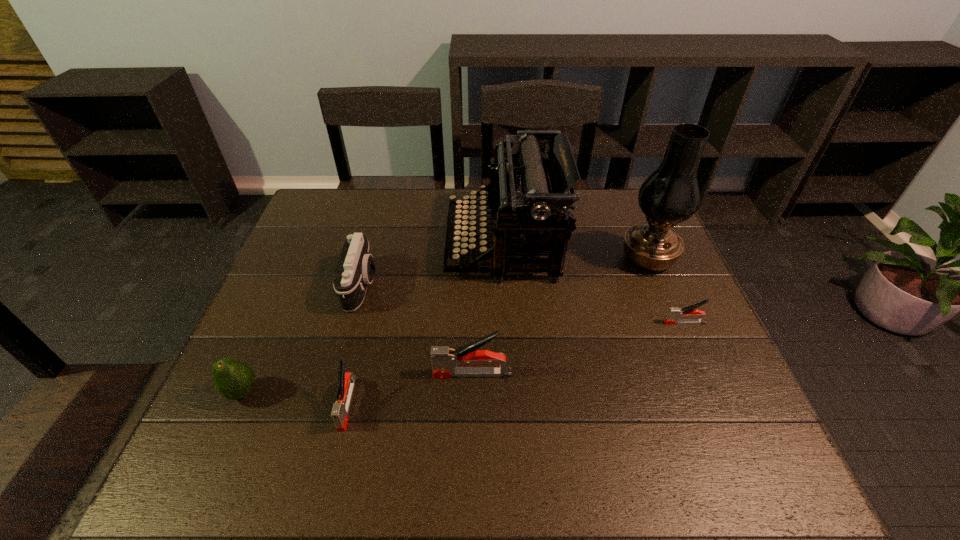
In order to click on free spot located on the handle side of the tallest stapler in this screenshot , I will do `click(358, 374)`.

Where is `vacant area situated 0.160m on the handle side of the shortest object`? vacant area situated 0.160m on the handle side of the shortest object is located at coordinates (601, 322).

At what (x,y) coordinates should I click in order to perform the action: click on free location located on the handle side of the shortest object. Please return your answer as a coordinate pair (x, y). The image size is (960, 540). Looking at the image, I should click on (561, 322).

Find the location of a particular element. vacant space located 0.150m on the handle side of the shortest object is located at coordinates (605, 322).

Identify the location of vacant area situated on the typing side of the second tallest object. The height and width of the screenshot is (540, 960). (430, 245).

This screenshot has width=960, height=540. In order to click on free space located 0.060m on the typing side of the second tallest object in this screenshot , I will do `click(427, 245)`.

Identify the location of free spot located on the typing side of the second tallest object. The image size is (960, 540). (353, 245).

Where is `vacant space situated on the back of the oil lamp`? The height and width of the screenshot is (540, 960). vacant space situated on the back of the oil lamp is located at coordinates (619, 188).

Identify the location of free space located 0.400m on the front lens of the camera. (526, 285).

Locate an element on the screen. This screenshot has width=960, height=540. blank space located 0.150m on the back of the leftmost object is located at coordinates (273, 326).